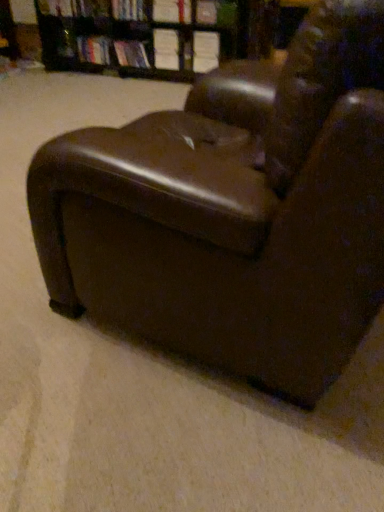
Question: Is point (147, 67) positioned closer to the camera than point (163, 45)?

Choices:
 (A) farther
 (B) closer

Answer: (A)

Question: Considering the positions of hardcover book at upper center, which appears as the fifth book when viewed from the right, and white paper book at upper center, the fourth book from the left, in the image, is hardcover book at upper center, which appears as the fifth book when viewed from the right, bigger or smaller than white paper book at upper center, the fourth book from the left,?

Choices:
 (A) small
 (B) big

Answer: (B)

Question: Which object is the closest to the hardcover book at upper center, the third book in the left-to-right sequence?

Choices:
 (A) hardcover book at center, arranged as the first book when viewed from the right
 (B) white paper book at upper center, which ranks as the 2th book in right-to-left order
 (C) brown leather bookcase at upper center
 (D) hardcover book at upper center, which is the 1th book from left to right
 (E) hardcover book at upper center, which appears as the fifth book when viewed from the right

Answer: (E)

Question: Estimate the real-world distances between objects in this image. Which object is farther from the hardcover book at upper center, which appears as the fifth book when viewed from the right?

Choices:
 (A) hardcover book at center, positioned as the 6th book in left-to-right order
 (B) hardcover book at upper center, the third book in the left-to-right sequence
 (C) hardcover book at upper center, which is the 1th book from left to right
 (D) brown leather armchair at center
 (E) brown leather bookcase at upper center

Answer: (D)